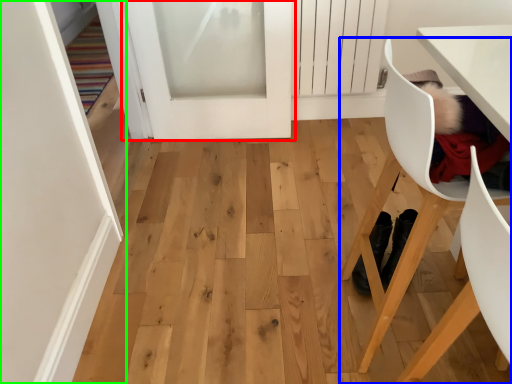
Question: Estimate the real-world distances between objects in this image. Which object is farther from door (highlighted by a red box), chair (highlighted by a blue box) or door (highlighted by a green box)?

Choices:
 (A) chair
 (B) door

Answer: (A)